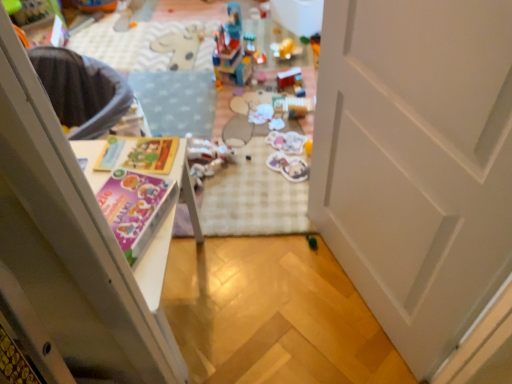
Question: Does translucent plastic stickers at center, the 4th toy from the bottom, have a lesser height compared to matte plastic stickers at center, the second toy from the bottom?

Choices:
 (A) yes
 (B) no

Answer: (B)

Question: Is translucent plastic stickers at center, arranged as the third toy when viewed from the top, smaller than matte plastic stickers at center, which ranks as the fifth toy in top-to-bottom order?

Choices:
 (A) yes
 (B) no

Answer: (A)

Question: Is translucent plastic stickers at center, the 4th toy from the bottom, further to camera compared to matte plastic stickers at center, which ranks as the fifth toy in top-to-bottom order?

Choices:
 (A) yes
 (B) no

Answer: (A)

Question: Is translucent plastic stickers at center, the 4th toy from the bottom, positioned in front of matte plastic stickers at center, which ranks as the fifth toy in top-to-bottom order?

Choices:
 (A) yes
 (B) no

Answer: (B)

Question: Is matte plastic stickers at center, the second toy from the bottom, inside translucent plastic stickers at center, the 4th toy from the bottom?

Choices:
 (A) yes
 (B) no

Answer: (B)

Question: Is brick-like plastic toy at center, which appears as the first toy when viewed from the top, inside the boundaries of translucent plastic stickers at center, the 4th toy from the bottom, or outside?

Choices:
 (A) outside
 (B) inside

Answer: (A)

Question: Is point (228, 18) closer or farther from the camera than point (283, 134)?

Choices:
 (A) farther
 (B) closer

Answer: (A)

Question: From the image's perspective, is brick-like plastic toy at center, which appears as the first toy when viewed from the top, located above or below translucent plastic stickers at center, the 4th toy from the bottom?

Choices:
 (A) above
 (B) below

Answer: (A)

Question: In terms of width, does brick-like plastic toy at center, which appears as the first toy when viewed from the top, look wider or thinner when compared to translucent plastic stickers at center, the 4th toy from the bottom?

Choices:
 (A) thin
 (B) wide

Answer: (B)

Question: Considering the positions of green matte toy at center, positioned as the sixth toy in top-to-bottom order, and translucent plastic toy at center, placed as the 4th toy when sorted from top to bottom, in the image, is green matte toy at center, positioned as the sixth toy in top-to-bottom order, taller or shorter than translucent plastic toy at center, placed as the 4th toy when sorted from top to bottom,?

Choices:
 (A) tall
 (B) short

Answer: (B)

Question: Visually, is green matte toy at center, positioned as the 1th toy in bottom-to-top order, positioned to the left or to the right of translucent plastic toy at center, placed as the 4th toy when sorted from top to bottom?

Choices:
 (A) right
 (B) left

Answer: (A)

Question: From the image's perspective, is green matte toy at center, positioned as the sixth toy in top-to-bottom order, positioned above or below translucent plastic toy at center, placed as the 4th toy when sorted from top to bottom?

Choices:
 (A) above
 (B) below

Answer: (B)

Question: Is point (309, 241) closer or farther from the camera than point (195, 150)?

Choices:
 (A) farther
 (B) closer

Answer: (B)

Question: Relative to green matte toy at center, positioned as the 1th toy in bottom-to-top order, is smooth plastic toy at center, arranged as the second toy when viewed from the top, in front or behind?

Choices:
 (A) front
 (B) behind

Answer: (B)

Question: In terms of width, does smooth plastic toy at center, the fifth toy when ordered from bottom to top, look wider or thinner when compared to green matte toy at center, positioned as the 1th toy in bottom-to-top order?

Choices:
 (A) wide
 (B) thin

Answer: (A)